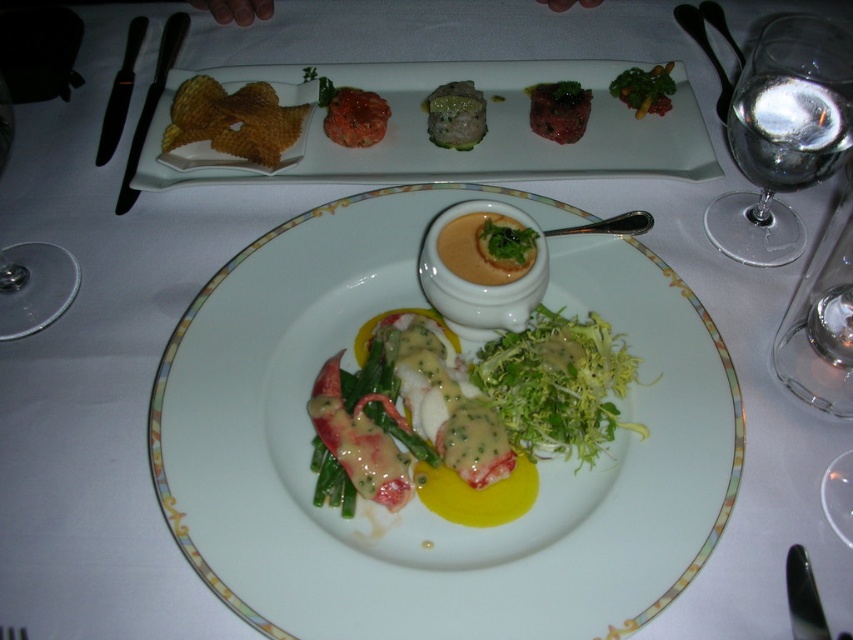
Is savory meat at center below glossy metal spoon at upper center?

Yes.

Between point (332, 108) and point (714, 17), which one is positioned in front?

Point (332, 108)

Image resolution: width=853 pixels, height=640 pixels. Find the location of `savory meat at center`. savory meat at center is located at coordinates (357, 116).

Which is behind, point (793, 134) or point (473, 372)?

The point (793, 134) is behind.

The height and width of the screenshot is (640, 853). What do you see at coordinates (782, 134) in the screenshot?
I see `transparent glass wine glass at upper right` at bounding box center [782, 134].

Is point (778, 28) less distant than point (518, 358)?

No, it is behind (518, 358).

At what (x,y) coordinates should I click in order to perform the action: click on transparent glass wine glass at upper right. Please return your answer as a coordinate pair (x, y). The image size is (853, 640). Looking at the image, I should click on (782, 134).

Does green leafy vegetable at center have a lesser height compared to glossy metal spoon at upper center?

Yes, green leafy vegetable at center is shorter than glossy metal spoon at upper center.

Is point (527, 246) farther from viewer compared to point (691, 4)?

No, it is not.

Find the location of `green leafy vegetable at center`. green leafy vegetable at center is located at coordinates (505, 243).